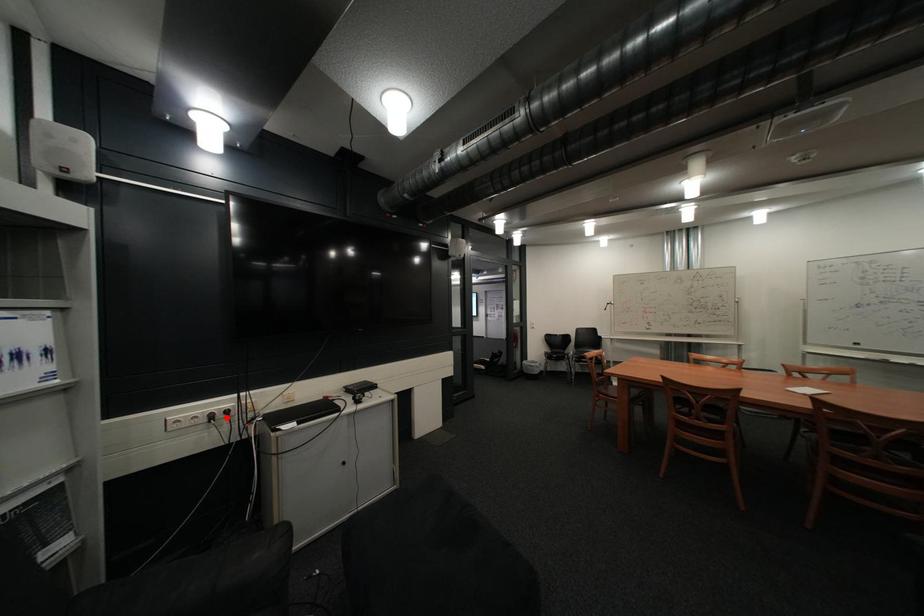
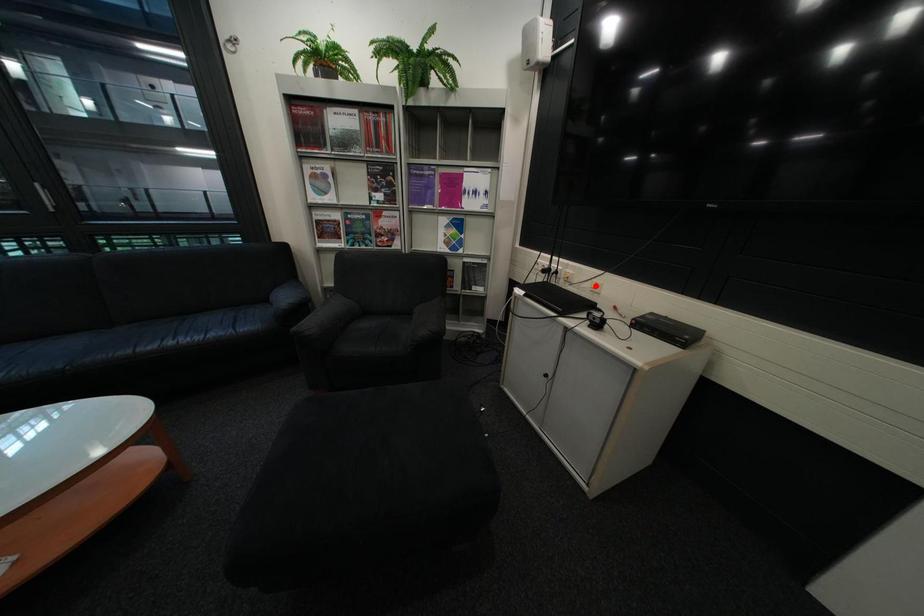
I am providing you with two images of the same scene from different viewpoints. A red point is marked on the first image and another point is marked on the second image. Are the points marked in image1 and image2 representing the same 3D position?

No